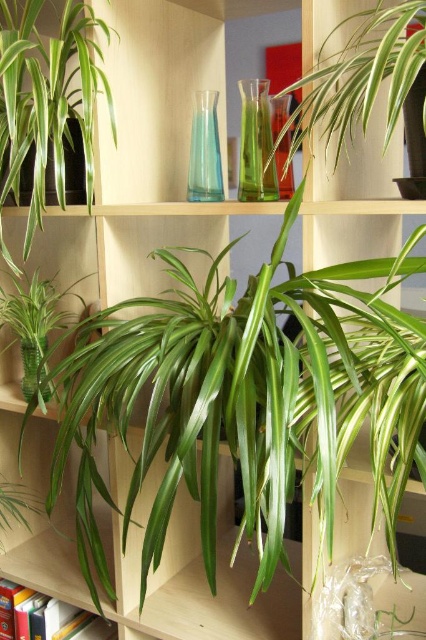
Question: Which of the following is the closest to the observer?

Choices:
 (A) (46, 364)
 (B) (380, 51)

Answer: (B)

Question: Which is farther from the transparent glass vase at lower left?

Choices:
 (A) green glass vase at center
 (B) green glossy plant at center

Answer: (A)

Question: Among these objects, which one is nearest to the camera?

Choices:
 (A) transparent glass vase at center
 (B) green glossy plant at upper left
 (C) green glass vase at center
 (D) green glossy plant at center

Answer: (B)

Question: Does transparent glass vase at center have a lesser width compared to transparent glass vase at lower left?

Choices:
 (A) yes
 (B) no

Answer: (A)

Question: Does green leafy plant at upper right appear on the left side of green glossy plant at center?

Choices:
 (A) no
 (B) yes

Answer: (A)

Question: Can you confirm if transparent glass vase at center is thinner than green glass vase at upper center?

Choices:
 (A) yes
 (B) no

Answer: (B)